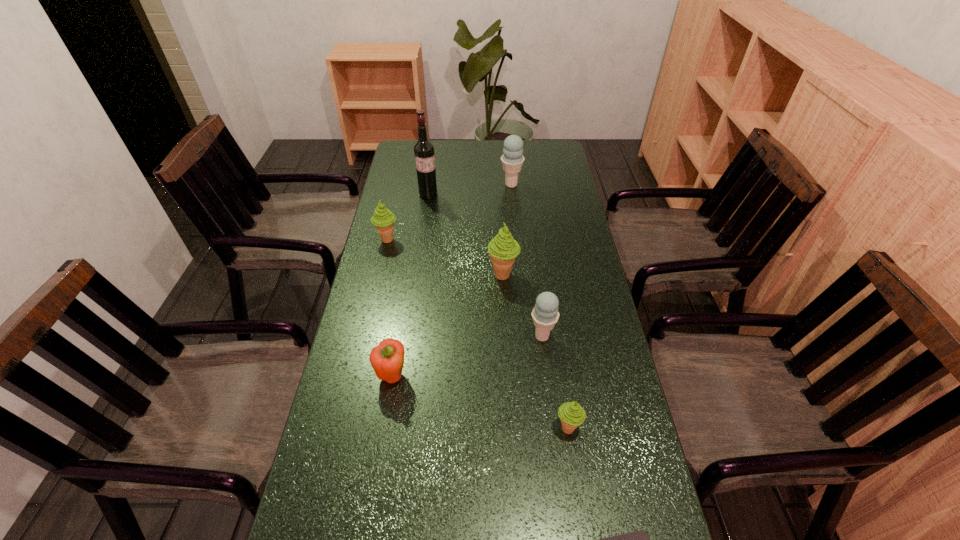
The height and width of the screenshot is (540, 960). What are the coordinates of `the tallest object` in the screenshot? It's located at (423, 149).

At what (x,y) coordinates should I click in order to perform the action: click on the farther blue ice cream. Please return your answer as a coordinate pair (x, y). This screenshot has height=540, width=960. Looking at the image, I should click on (512, 159).

The width and height of the screenshot is (960, 540). In order to click on the farthest icecream in this screenshot , I will do `click(512, 159)`.

Where is `the second farthest green icecream`? The image size is (960, 540). the second farthest green icecream is located at coordinates (503, 249).

The image size is (960, 540). In order to click on the fifth nearest object in this screenshot , I will do `click(503, 249)`.

You are a GUI agent. You are given a task and a screenshot of the screen. Output one action in this format:
    pyautogui.click(x=<x>, y=<y>)
    Task: Click on the leftmost icecream
    This screenshot has height=540, width=960.
    Given the screenshot: What is the action you would take?
    pyautogui.click(x=383, y=219)

At what (x,y) coordinates should I click in order to perform the action: click on the second smallest green icecream. Please return your answer as a coordinate pair (x, y). Looking at the image, I should click on (383, 219).

The height and width of the screenshot is (540, 960). In order to click on the fourth nearest object in this screenshot , I will do `click(545, 314)`.

Identify the location of the nearer blue ice cream. (545, 314).

At what (x,y) coordinates should I click in order to perform the action: click on orange pepper. Please return your answer as a coordinate pair (x, y). Image resolution: width=960 pixels, height=540 pixels. Looking at the image, I should click on (387, 359).